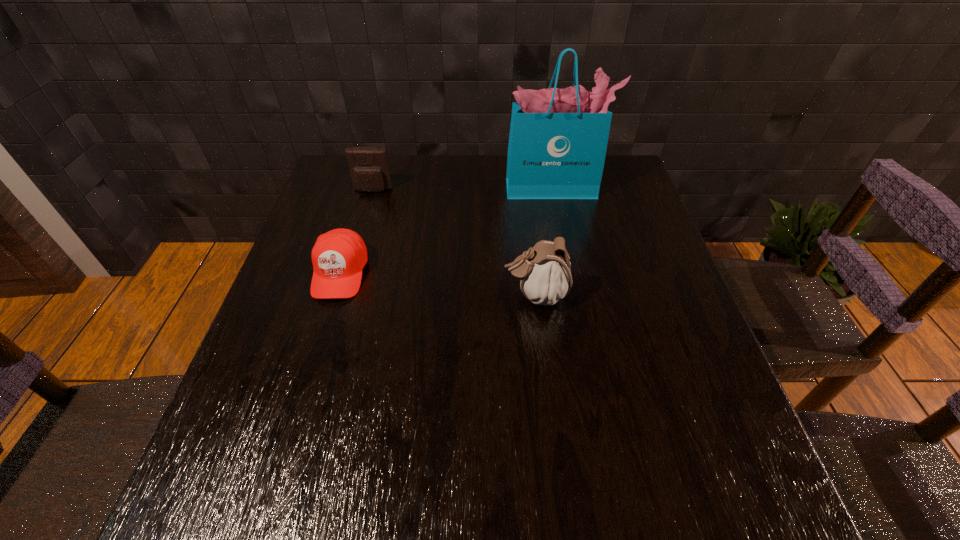
The width and height of the screenshot is (960, 540). I want to click on vacant region at the near edge of the desktop, so click(400, 466).

Locate an element on the screen. The height and width of the screenshot is (540, 960). blank space at the left edge of the desktop is located at coordinates (270, 330).

Where is `vacant space at the right edge`? The image size is (960, 540). vacant space at the right edge is located at coordinates (618, 302).

Identify the location of free spot at the near left corner of the desktop. (216, 493).

Image resolution: width=960 pixels, height=540 pixels. In order to click on blank region between the shortest object and the taller pouch in this screenshot , I will do `click(438, 284)`.

You are a GUI agent. You are given a task and a screenshot of the screen. Output one action in this format:
    pyautogui.click(x=<x>, y=<y>)
    Task: Click on the vacant space in between the baseball cap and the taller pouch
    The width and height of the screenshot is (960, 540).
    Given the screenshot: What is the action you would take?
    pyautogui.click(x=438, y=284)

The image size is (960, 540). What are the coordinates of `free spot between the baseball cap and the second tallest object` in the screenshot? It's located at (438, 284).

Locate an element on the screen. free space between the baseball cap and the farther pouch is located at coordinates (356, 232).

The height and width of the screenshot is (540, 960). Identify the location of unoccupied area between the shortest object and the farther pouch. (356, 232).

I want to click on blank region between the taller pouch and the left pouch, so click(454, 243).